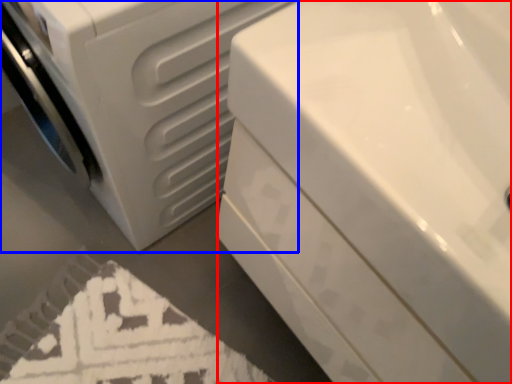
Question: Among these objects, which one is farthest to the camera, bath (highlighted by a red box) or washing machine (highlighted by a blue box)?

Choices:
 (A) bath
 (B) washing machine

Answer: (B)